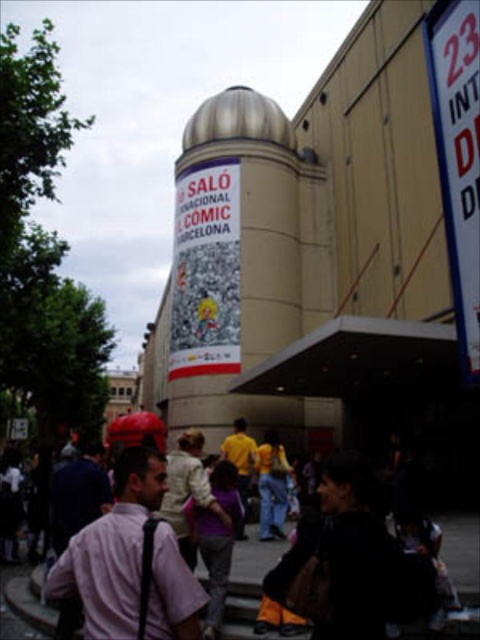
Question: Which of the following is the closest to the observer?

Choices:
 (A) dark clothing crowd at center
 (B) pink cotton shirt at center

Answer: (A)

Question: Does pink cotton shirt at center appear over white plastic sign at upper right?

Choices:
 (A) yes
 (B) no

Answer: (B)

Question: Which point appears farthest from the camera in this image?

Choices:
 (A) (458, 323)
 (B) (408, 589)

Answer: (A)

Question: Is dark clothing crowd at center to the left of pink cotton shirt at center from the viewer's perspective?

Choices:
 (A) yes
 (B) no

Answer: (A)

Question: Which point is closer to the camera?

Choices:
 (A) pink cotton shirt at center
 (B) white plastic sign at upper right
 (C) dark clothing crowd at center

Answer: (C)

Question: Observing the image, what is the correct spatial positioning of dark clothing crowd at center in reference to pink cotton shirt at center?

Choices:
 (A) right
 (B) left

Answer: (B)